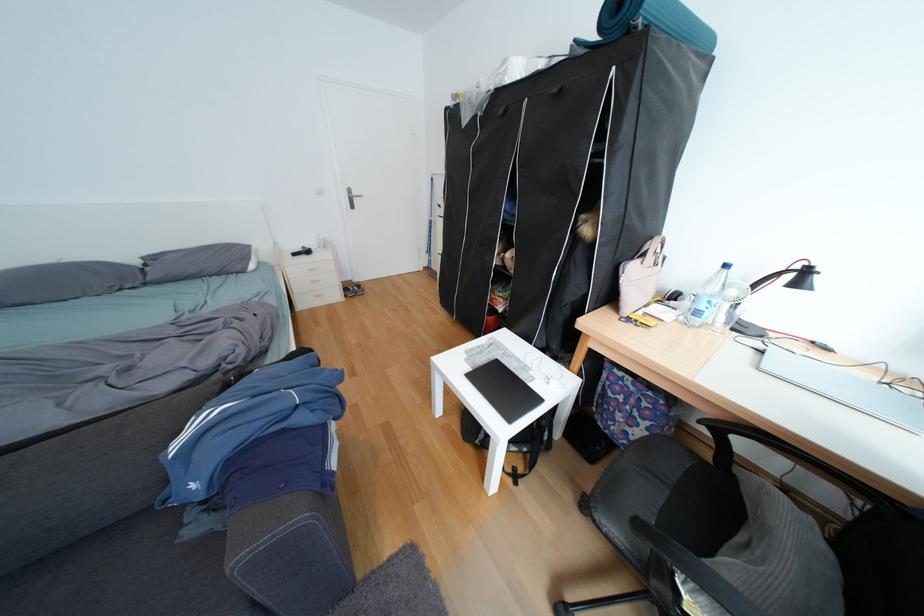
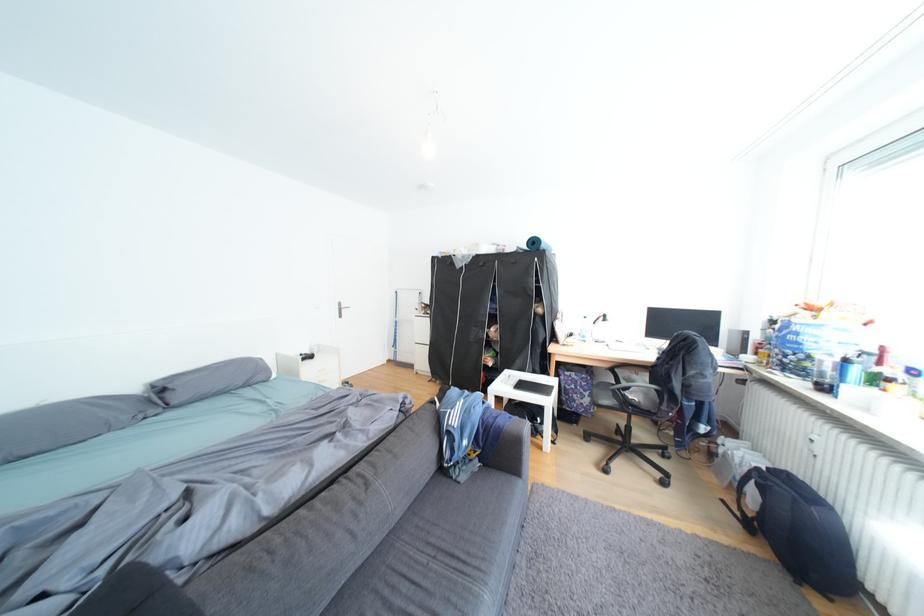
In the second image, find the point that corresponds to (x=697, y=305) in the first image.

(590, 337)